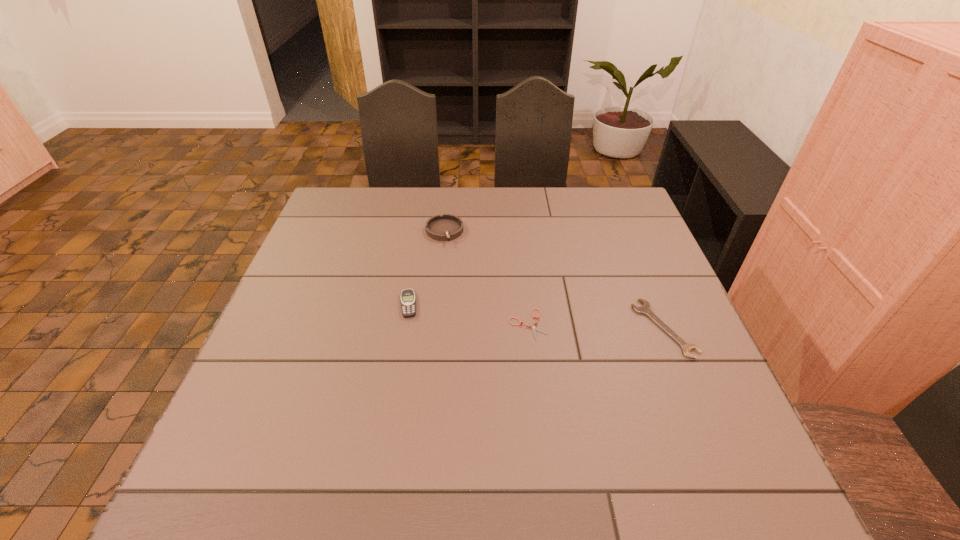
In order to click on ashtray in this screenshot , I will do `click(446, 227)`.

Identify the location of the farthest object. Image resolution: width=960 pixels, height=540 pixels. (446, 227).

Where is `the second tallest object`? the second tallest object is located at coordinates (407, 296).

Identify the location of the third tallest object. This screenshot has width=960, height=540. (646, 309).

Where is `the rightmost object`? This screenshot has height=540, width=960. the rightmost object is located at coordinates (646, 309).

At what (x,y) coordinates should I click in order to perform the action: click on the third object from left to right. Please return your answer as a coordinate pair (x, y). The image size is (960, 540). Looking at the image, I should click on (534, 328).

Locate an element on the screen. shears is located at coordinates (534, 328).

Image resolution: width=960 pixels, height=540 pixels. Identify the location of vacant space located on the back of the tallest object. (447, 198).

Identify the location of free space located 0.160m on the back of the third shortest object. pyautogui.click(x=418, y=253).

Locate an element on the screen. vacant space located on the left of the second shortest object is located at coordinates (516, 328).